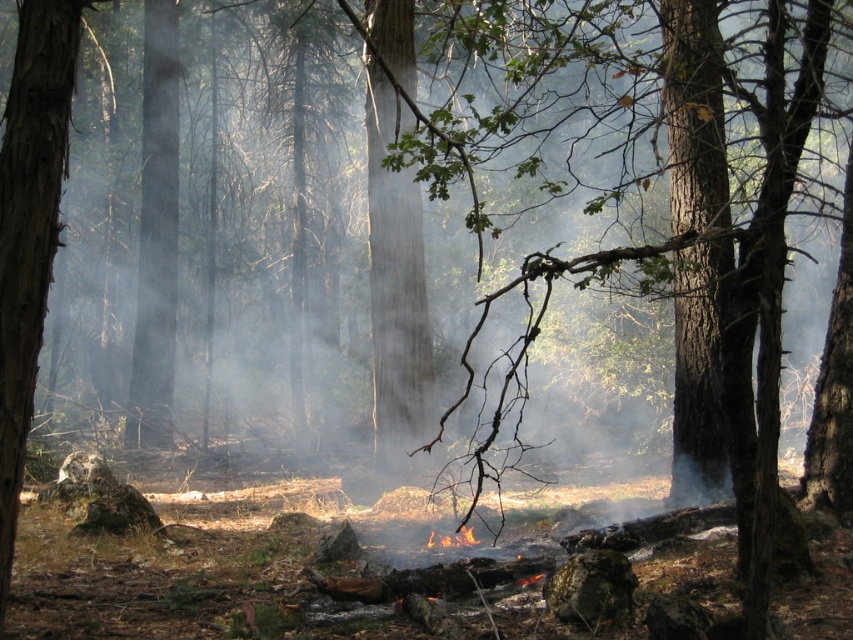
You are a hiker who has just entered the forest and wants to locate the smooth bark tree at left. According to the coordinates provided, where should you look relative to your current position?

The smooth bark tree at left is located at coordinates point (28, 228), so you should look to the left side of the forest area near the front.

You are standing at the point marked as point [4,300] in the forest scene. You want to walk to a tree that is 15.34 feet away from your current position. Is there a tree within that distance that you can reach without crossing the fire?

Yes, there are trees in the forest scene within 15.34 feet of point [4,300], so you can reach a tree without crossing the fire.

You are standing in the forest and see a point marked at coordinates (x=28, y=228). What is located at that point?

The point at (x=28, y=228) marks the location of a smooth bark tree at left.